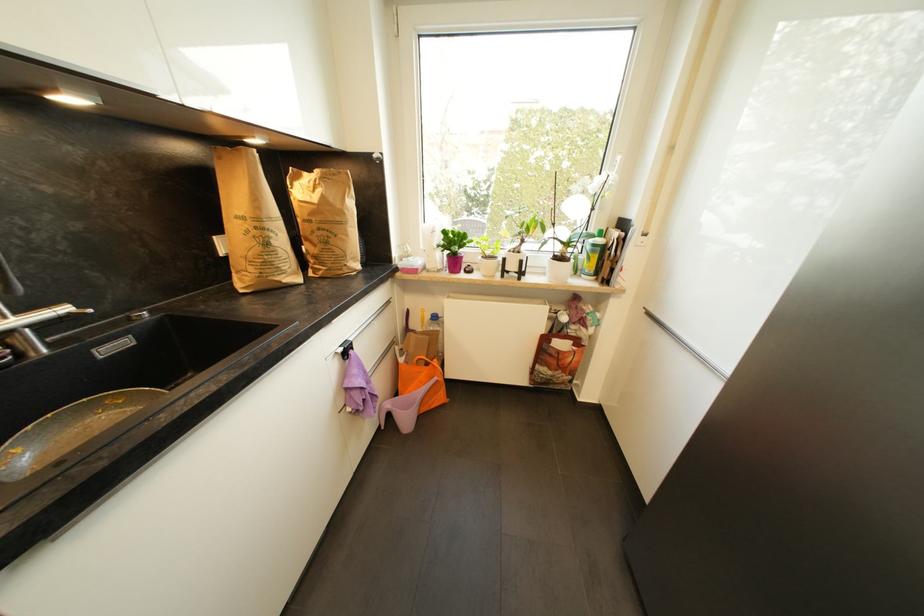
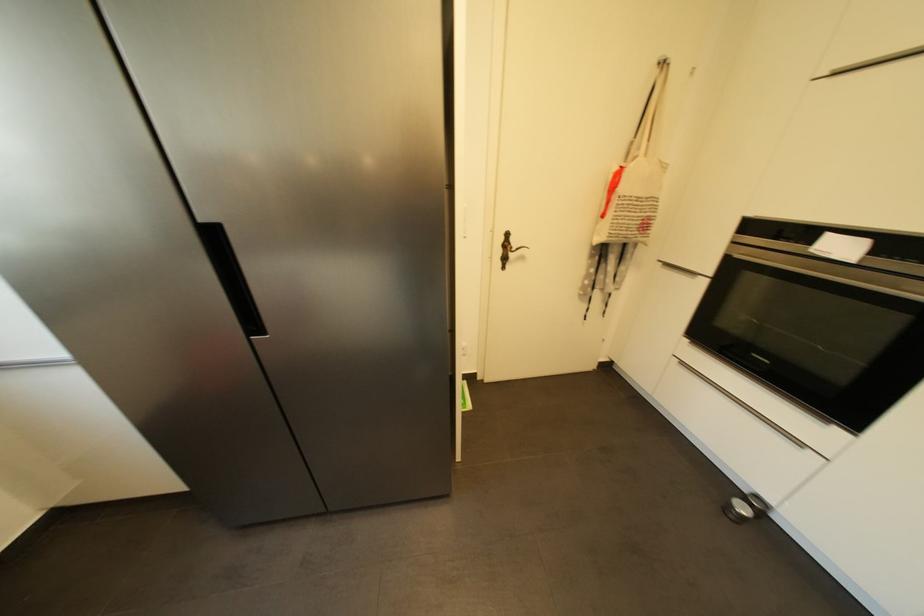
From the picture: First-person continuous shooting, in which direction is the camera rotating?

The rotation direction of the camera is right-down.